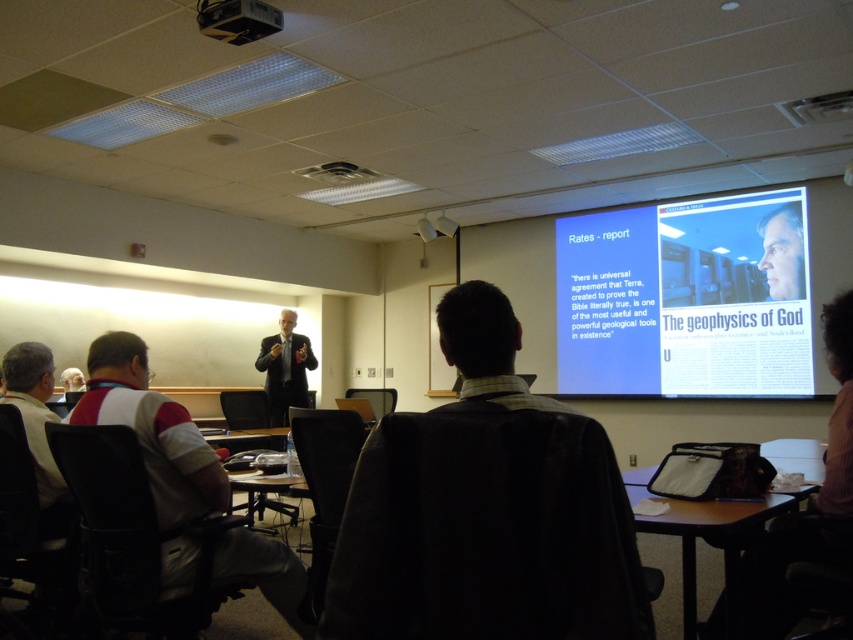
You are a student sitting in the classroom and need to place a textbook on a surface. You can choose between the black plastic table at lower right and the smooth skin face at upper right. Which surface has a wider area to place the textbook?

The black plastic table at lower right has a larger width than the smooth skin face at upper right, so it provides a wider area to place the textbook.

You are standing in the classroom and see two points marked on the screen. Which point is closer to you, point (671, 294) or point (630, 490)?

Point (671, 294) is further to the viewer than point (630, 490), so point (630, 490) is closer to you.